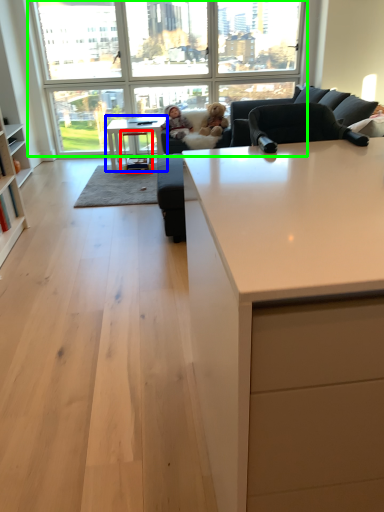
Question: Which object is positioned farthest from stool (highlighted by a red box)? Select from table (highlighted by a blue box) and window (highlighted by a green box).

Choices:
 (A) table
 (B) window

Answer: (B)